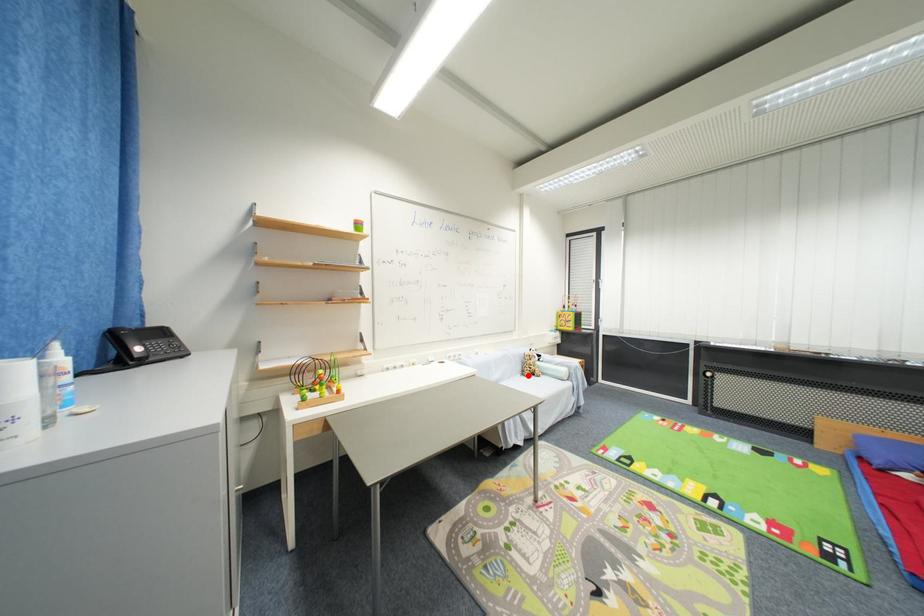
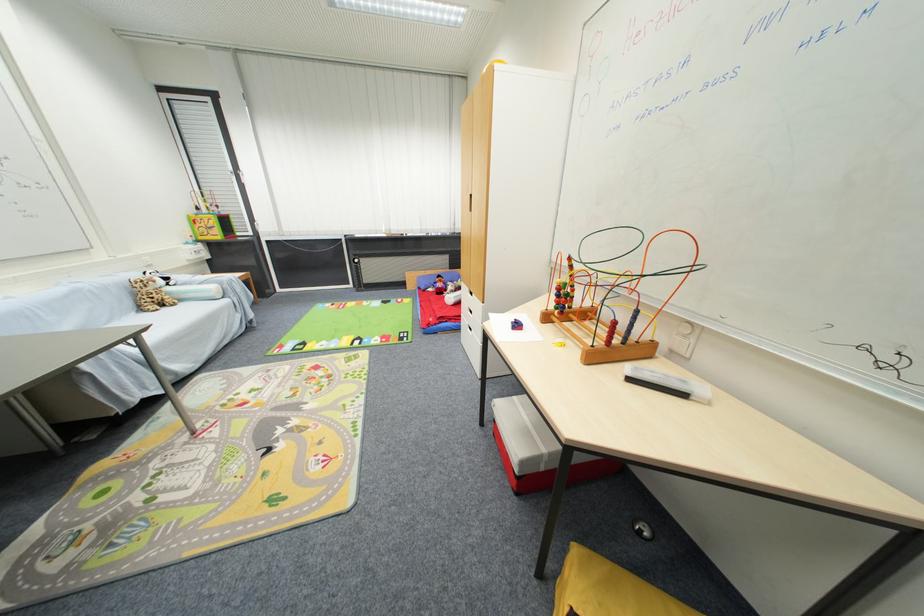
Locate, in the second image, the point that corresponds to the highlighted location in the first image.

(146, 310)